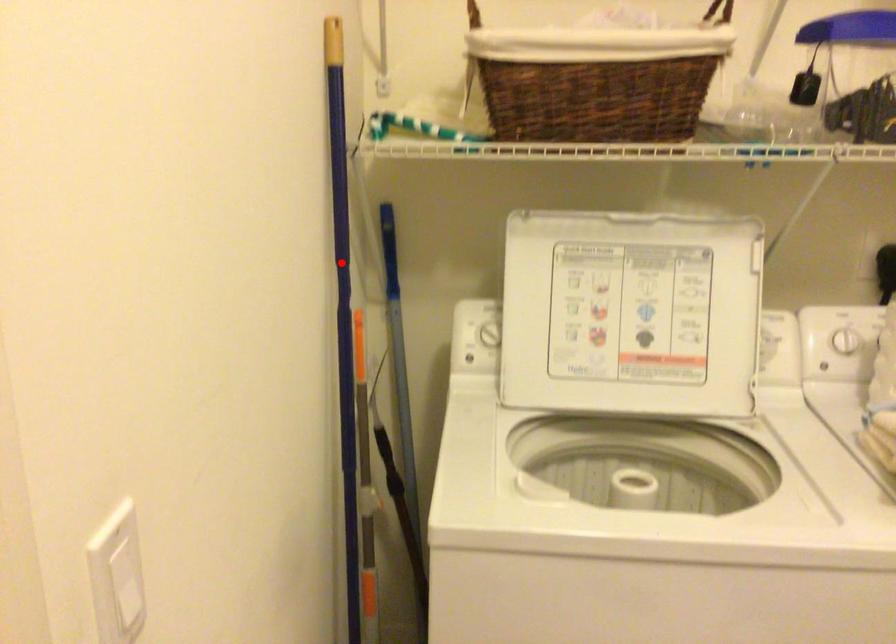
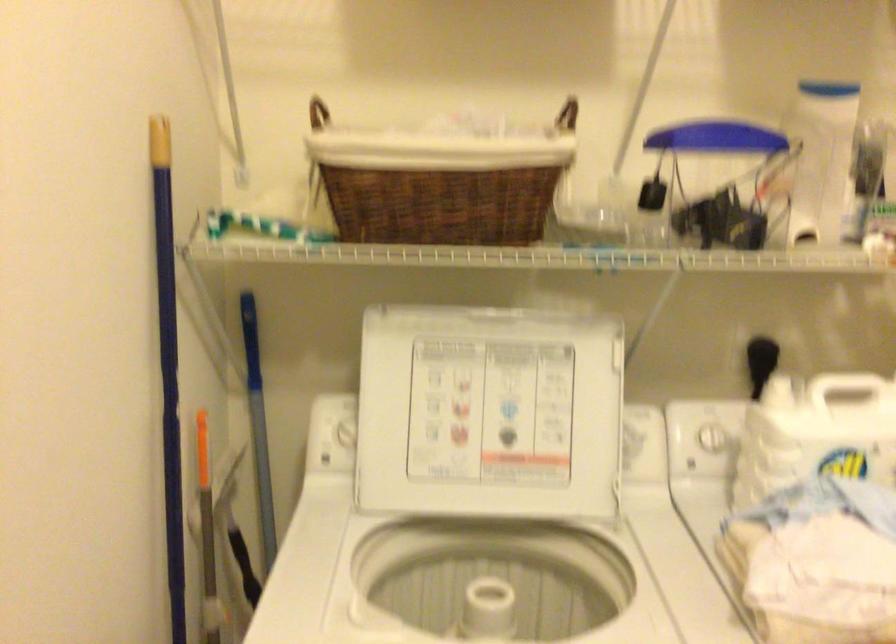
The point at the highlighted location is marked in the first image. Where is the corresponding point in the second image?

(168, 366)